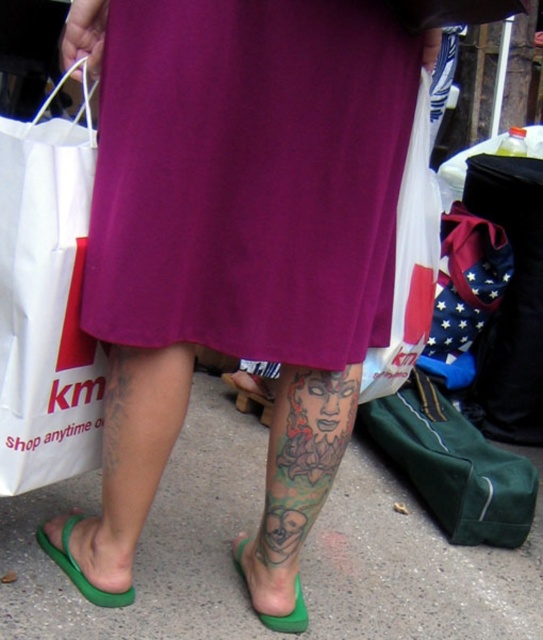
Question: Which of the following is the closest to the observer?

Choices:
 (A) (156, 502)
 (B) (85, 579)
 (C) (103, 234)

Answer: (C)

Question: Observing the image, what is the correct spatial positioning of green rubber flip-flops at lower center in reference to green matte sandal at lower center?

Choices:
 (A) right
 (B) left

Answer: (A)

Question: Does purple fabric skirt at center have a lesser width compared to white plastic bag at center?

Choices:
 (A) no
 (B) yes

Answer: (A)

Question: Among these points, which one is nearest to the camera?

Choices:
 (A) (412, 465)
 (B) (11, 352)
 (C) (72, 522)

Answer: (B)

Question: From the image, what is the correct spatial relationship of green fabric bag at lower right in relation to green matte sandal at lower center?

Choices:
 (A) above
 (B) below

Answer: (A)

Question: Which point is farther to the camera?

Choices:
 (A) (53, 360)
 (B) (493, 529)

Answer: (B)